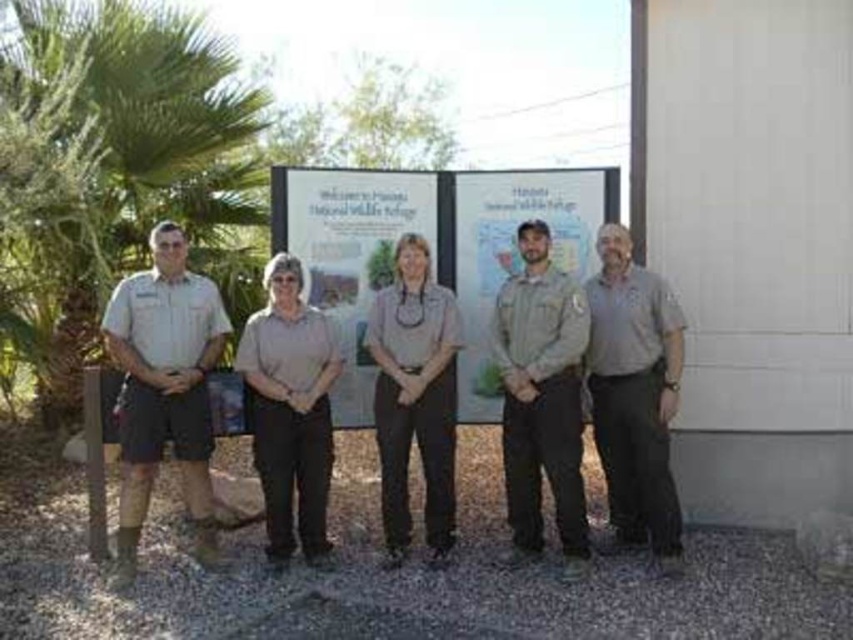
Who is lower down, tan uniform at left or gray cotton shirt at right?

gray cotton shirt at right

Which is in front, point (132, 456) or point (631, 275)?

Positioned in front is point (132, 456).

Locate an element on the screen. tan uniform at left is located at coordinates (165, 388).

Does khaki uniform pants at center have a greater height compared to gray uniform at center?

Yes.

Is point (537, 288) more distant than point (434, 458)?

Yes, it is behind point (434, 458).

What are the coordinates of `khaki uniform pants at center` in the screenshot? It's located at (543, 397).

Is tan uniform at left wider than gray uniform at center?

Correct, the width of tan uniform at left exceeds that of gray uniform at center.

Which is below, tan uniform at left or gray uniform at center?

gray uniform at center is below.

Who is more distant from viewer, (x=196, y=307) or (x=434, y=426)?

Positioned behind is point (x=434, y=426).

Where is `tan uniform at left`? Image resolution: width=853 pixels, height=640 pixels. tan uniform at left is located at coordinates (165, 388).